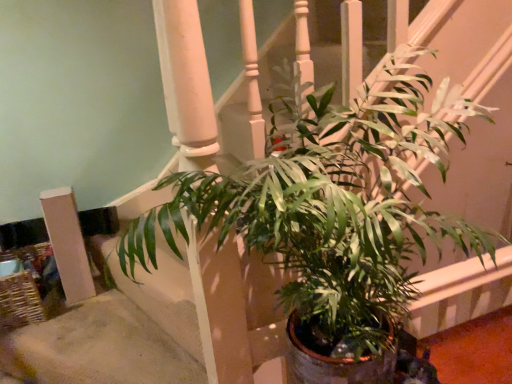
Question: From the image's perspective, is green glossy leafy plant at center located above white matte pillar at lower left?

Choices:
 (A) no
 (B) yes

Answer: (B)

Question: Does green glossy leafy plant at center lie in front of white matte pillar at lower left?

Choices:
 (A) no
 (B) yes

Answer: (B)

Question: Considering the relative sizes of green glossy leafy plant at center and white matte pillar at lower left in the image provided, is green glossy leafy plant at center taller than white matte pillar at lower left?

Choices:
 (A) yes
 (B) no

Answer: (A)

Question: Can you confirm if green glossy leafy plant at center is thinner than white matte pillar at lower left?

Choices:
 (A) yes
 (B) no

Answer: (B)

Question: From a real-world perspective, is green glossy leafy plant at center below white matte pillar at lower left?

Choices:
 (A) no
 (B) yes

Answer: (A)

Question: Is green glossy leafy plant at center behind white matte pillar at lower left?

Choices:
 (A) yes
 (B) no

Answer: (B)

Question: From a real-world perspective, is white matte pillar at lower left located beneath green glossy leafy plant at center?

Choices:
 (A) no
 (B) yes

Answer: (B)

Question: Is white matte pillar at lower left outside of green glossy leafy plant at center?

Choices:
 (A) no
 (B) yes

Answer: (B)

Question: Considering the relative sizes of white matte pillar at lower left and green glossy leafy plant at center in the image provided, is white matte pillar at lower left bigger than green glossy leafy plant at center?

Choices:
 (A) no
 (B) yes

Answer: (A)

Question: Is white matte pillar at lower left aimed at green glossy leafy plant at center?

Choices:
 (A) no
 (B) yes

Answer: (A)

Question: Is white matte pillar at lower left taller than green glossy leafy plant at center?

Choices:
 (A) yes
 (B) no

Answer: (B)

Question: From the image's perspective, is white matte pillar at lower left located above green glossy leafy plant at center?

Choices:
 (A) yes
 (B) no

Answer: (B)

Question: Considering the relative positions of white matte pillar at lower left and green glossy leafy plant at center in the image provided, is white matte pillar at lower left to the left or to the right of green glossy leafy plant at center?

Choices:
 (A) left
 (B) right

Answer: (A)